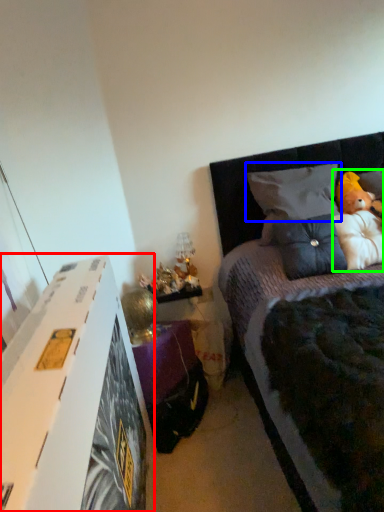
Question: Estimate the real-world distances between objects in this image. Which object is closer to nightstand (highlighted by a red box), pillow (highlighted by a blue box) or doll (highlighted by a green box)?

Choices:
 (A) pillow
 (B) doll

Answer: (A)